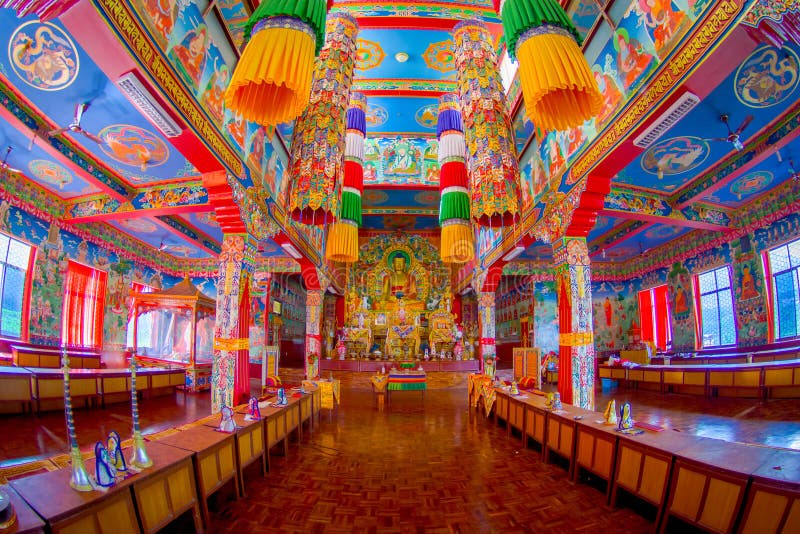
Where is `windows`? This screenshot has height=534, width=800. windows is located at coordinates (782, 301), (721, 312), (653, 316), (17, 272), (90, 300), (142, 323).